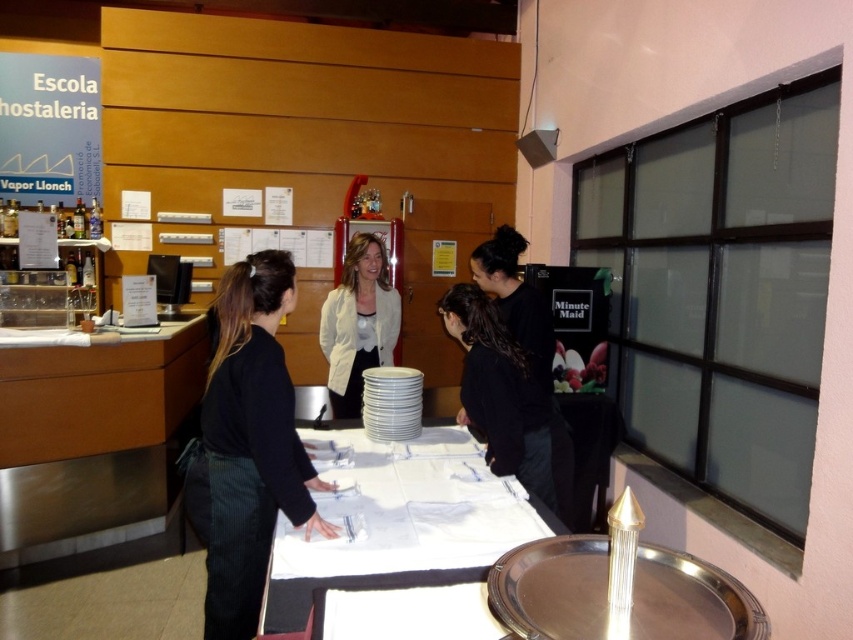
You are a student in the culinary school and need to place a 14 inch long utensil between the white cloth at center and the black matte jacket at center. Is there enough space?

The white cloth at center is 13.92 inches from the black matte jacket at center. Since the utensil is 14 inches long, it would not fit between them as the distance is slightly less than the utensil length.

In the scene shown: You are standing in the restaurant and see the point at coordinates (500, 394). Which object is this point located on?

The point at coordinates (500, 394) is located on the black matte jacket at center.

You are a guest entering the restaurant and want to approach the staff member wearing both the black corduroy pants at center and the white matte jacket at center. Which piece of clothing will you see first as you approach them?

The black corduroy pants at center will be seen first because it is closer to the viewer than the white matte jacket at center.